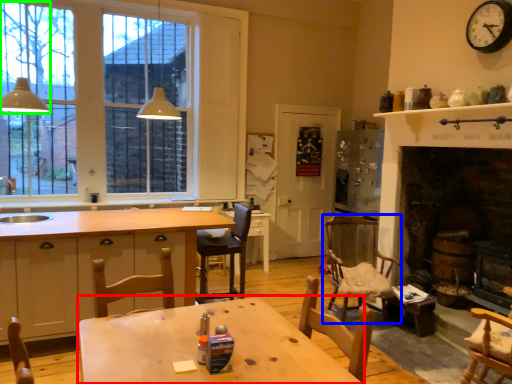
Question: Considering the real-world distances, which object is closest to table (highlighted by a red box)? chair (highlighted by a blue box) or light fixture (highlighted by a green box).

Choices:
 (A) chair
 (B) light fixture

Answer: (A)